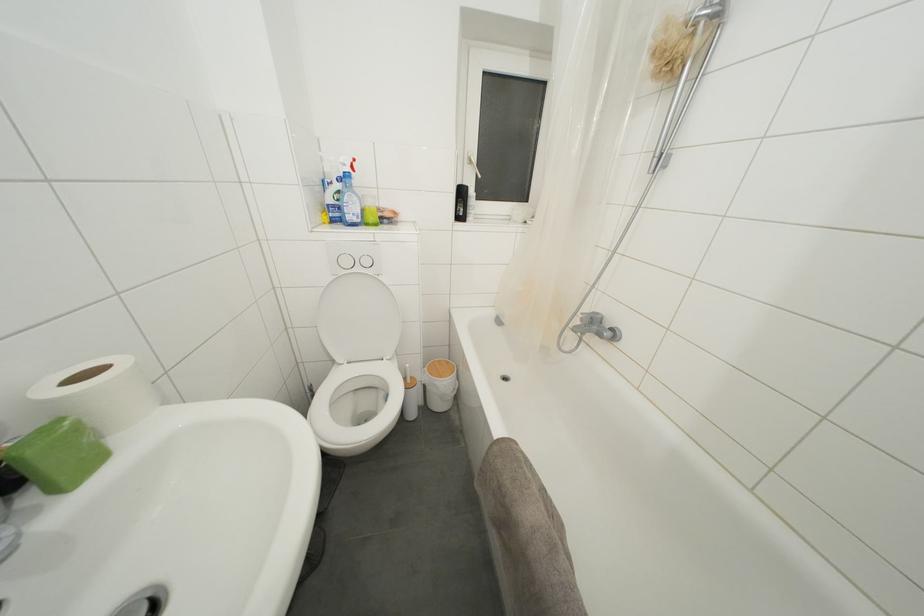
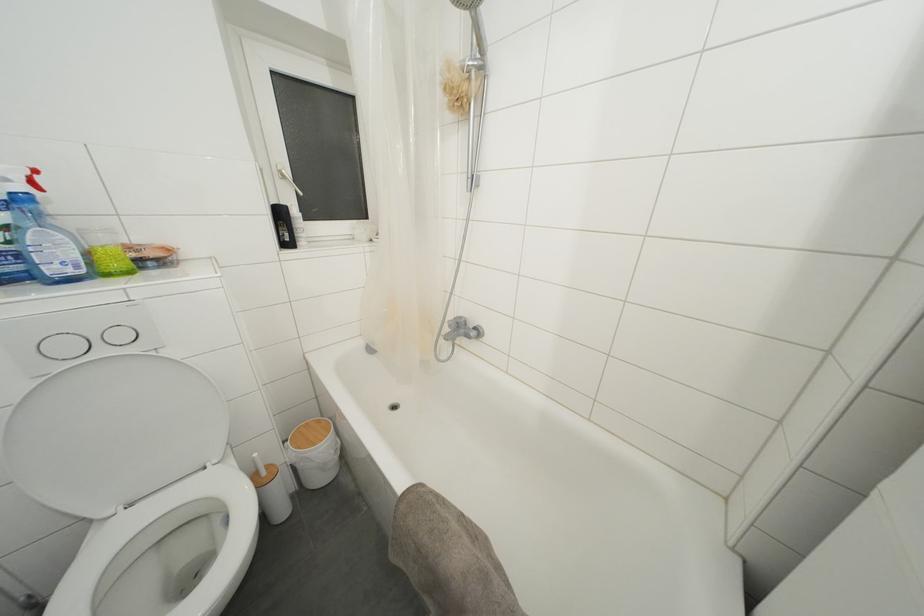
In the second image, find the point that corresponds to pixel 503 444 in the first image.

(407, 498)